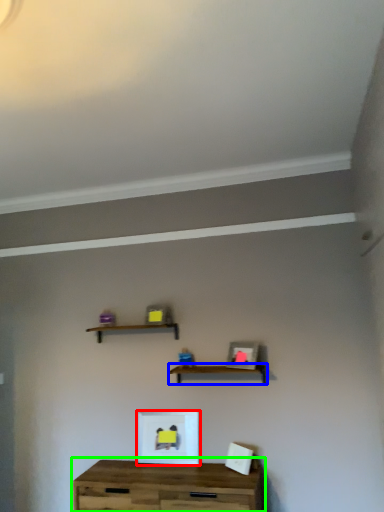
Question: Which object is positioned closest to picture frame (highlighted by a red box)? Select from shelf (highlighted by a blue box) and table (highlighted by a green box).

Choices:
 (A) shelf
 (B) table

Answer: (B)